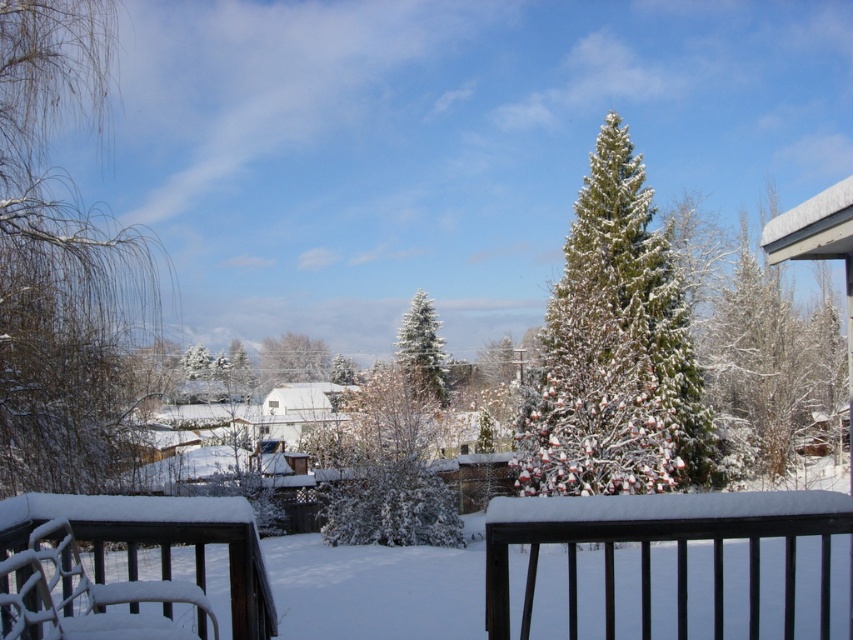
Question: In this image, where is snow-covered willow at left located relative to snow-covered evergreen at center?

Choices:
 (A) right
 (B) left

Answer: (B)

Question: Estimate the real-world distances between objects in this image. Which object is farther from the snow-covered willow at left?

Choices:
 (A) white fluffy bush at center
 (B) white frosty tree at center

Answer: (B)

Question: Which point is closer to the camera?

Choices:
 (A) snow-covered evergreen at center
 (B) snow-covered wooden porch at lower center

Answer: (B)

Question: Among these points, which one is nearest to the camera?

Choices:
 (A) (173, 499)
 (B) (631, 225)

Answer: (A)

Question: Can you confirm if snow-covered wooden porch at lower center is positioned to the left of white fluffy bush at center?

Choices:
 (A) yes
 (B) no

Answer: (B)

Question: Does snow-covered wooden porch at lower center have a smaller size compared to white fluffy bush at center?

Choices:
 (A) no
 (B) yes

Answer: (B)